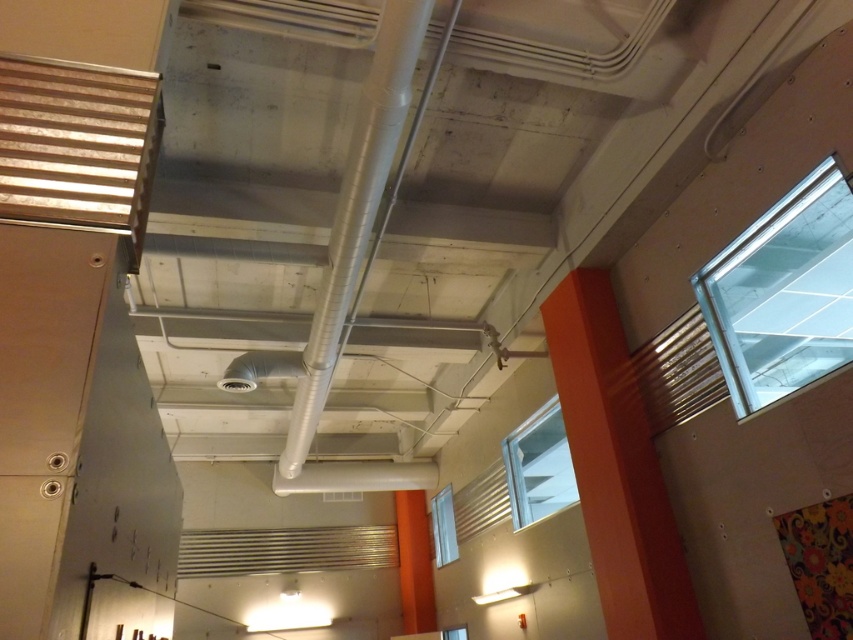
Question: Where is orange matte pillar at center located in relation to silver metallic pipe at center in the image?

Choices:
 (A) left
 (B) right

Answer: (B)

Question: Which of the following is the closest to the observer?

Choices:
 (A) silver metallic pipe at center
 (B) orange matte pillar at center

Answer: (A)

Question: Does orange matte pillar at center appear on the right side of silver metallic pipe at center?

Choices:
 (A) yes
 (B) no

Answer: (A)

Question: Can you confirm if orange matte pillar at center is thinner than silver metallic pipe at center?

Choices:
 (A) no
 (B) yes

Answer: (B)

Question: Which object is farther from the camera taking this photo?

Choices:
 (A) orange matte pillar at center
 (B) silver metallic pipe at center

Answer: (A)